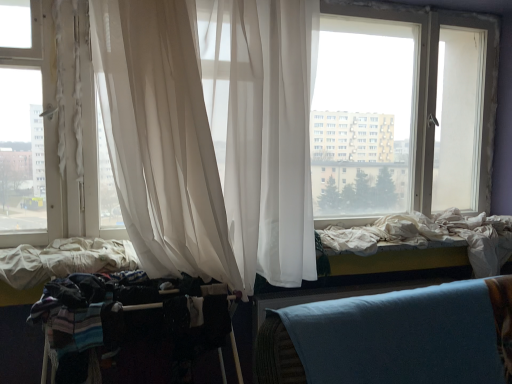
What do you see at coordinates (211, 138) in the screenshot?
I see `sheer white curtain at center` at bounding box center [211, 138].

The image size is (512, 384). I want to click on sheer white curtain at center, so click(211, 138).

What is the approximate height of sheer white curtain at center?

The height of sheer white curtain at center is 3.67 feet.

Image resolution: width=512 pixels, height=384 pixels. What are the coordinates of `dark fabric baby carriage at lower left` in the screenshot? It's located at (133, 323).

Image resolution: width=512 pixels, height=384 pixels. Describe the element at coordinates (133, 323) in the screenshot. I see `dark fabric baby carriage at lower left` at that location.

This screenshot has height=384, width=512. In order to click on sheer white curtain at center in this screenshot , I will do `click(211, 138)`.

Is sheer white curtain at center to the right of dark fabric baby carriage at lower left from the viewer's perspective?

Correct, you'll find sheer white curtain at center to the right of dark fabric baby carriage at lower left.

Does sheer white curtain at center lie in front of dark fabric baby carriage at lower left?

Yes, sheer white curtain at center is in front of dark fabric baby carriage at lower left.

Does point (246, 285) come closer to viewer compared to point (68, 325)?

No, (246, 285) is further to viewer.

From the image's perspective, between sheer white curtain at center and dark fabric baby carriage at lower left, who is located below?

From the image's view, dark fabric baby carriage at lower left is below.

In the scene shown: From a real-world perspective, is sheer white curtain at center physically below dark fabric baby carriage at lower left?

No, from a real-world perspective, sheer white curtain at center is not under dark fabric baby carriage at lower left.

Looking at this image, does sheer white curtain at center have a lesser width compared to dark fabric baby carriage at lower left?

No, sheer white curtain at center is not thinner than dark fabric baby carriage at lower left.

Is sheer white curtain at center taller than dark fabric baby carriage at lower left?

Correct, sheer white curtain at center is much taller as dark fabric baby carriage at lower left.

Does sheer white curtain at center have a smaller size compared to dark fabric baby carriage at lower left?

Actually, sheer white curtain at center might be larger than dark fabric baby carriage at lower left.

Is sheer white curtain at center outside of dark fabric baby carriage at lower left?

Yes, sheer white curtain at center is located beyond the bounds of dark fabric baby carriage at lower left.

Looking at this image, is sheer white curtain at center next to dark fabric baby carriage at lower left and touching it?

No, sheer white curtain at center is not in contact with dark fabric baby carriage at lower left.

Does sheer white curtain at center turn towards dark fabric baby carriage at lower left?

No, sheer white curtain at center does not turn towards dark fabric baby carriage at lower left.

Consider the image. How different are the orientations of sheer white curtain at center and dark fabric baby carriage at lower left in degrees?

The angle between the facing direction of sheer white curtain at center and the facing direction of dark fabric baby carriage at lower left is 0.000119 degrees.

Find the location of `curtain located on the right of dark fabric baby carriage at lower left`. curtain located on the right of dark fabric baby carriage at lower left is located at coordinates (211, 138).

Visually, is dark fabric baby carriage at lower left positioned to the left or to the right of sheer white curtain at center?

dark fabric baby carriage at lower left is positioned on sheer white curtain at center's left side.

Is dark fabric baby carriage at lower left further to the viewer compared to sheer white curtain at center?

Yes, the depth of dark fabric baby carriage at lower left is greater than that of sheer white curtain at center.

Which point is more distant from viewer, (117, 305) or (251, 256)?

The point (251, 256) is farther.

From the image's perspective, which one is positioned lower, dark fabric baby carriage at lower left or sheer white curtain at center?

dark fabric baby carriage at lower left is shown below in the image.

From a real-world perspective, is dark fabric baby carriage at lower left positioned over sheer white curtain at center based on gravity?

No, from a real-world perspective, dark fabric baby carriage at lower left is not on top of sheer white curtain at center.

Which object is wider, dark fabric baby carriage at lower left or sheer white curtain at center?

sheer white curtain at center.

Considering the sizes of objects dark fabric baby carriage at lower left and sheer white curtain at center in the image provided, who is taller, dark fabric baby carriage at lower left or sheer white curtain at center?

Standing taller between the two is sheer white curtain at center.

Consider the image. Considering the relative sizes of dark fabric baby carriage at lower left and sheer white curtain at center in the image provided, is dark fabric baby carriage at lower left bigger than sheer white curtain at center?

Actually, dark fabric baby carriage at lower left might be smaller than sheer white curtain at center.

Would you say dark fabric baby carriage at lower left is outside sheer white curtain at center?

Yes, dark fabric baby carriage at lower left is located beyond the bounds of sheer white curtain at center.

Are dark fabric baby carriage at lower left and sheer white curtain at center making contact?

There is a gap between dark fabric baby carriage at lower left and sheer white curtain at center.

Could you tell me if dark fabric baby carriage at lower left is facing sheer white curtain at center?

No, dark fabric baby carriage at lower left is not aimed at sheer white curtain at center.

From the picture: How different are the orientations of dark fabric baby carriage at lower left and sheer white curtain at center in degrees?

The angular difference between dark fabric baby carriage at lower left and sheer white curtain at center is 0.000119 degrees.

Locate an element on the screen. Image resolution: width=512 pixels, height=384 pixels. baby carriage that appears on the left of sheer white curtain at center is located at coordinates (133, 323).

At what (x,y) coordinates should I click in order to perform the action: click on curtain above the dark fabric baby carriage at lower left (from a real-world perspective). Please return your answer as a coordinate pair (x, y). The width and height of the screenshot is (512, 384). Looking at the image, I should click on (x=211, y=138).

This screenshot has height=384, width=512. In order to click on curtain that is in front of the dark fabric baby carriage at lower left in this screenshot , I will do `click(211, 138)`.